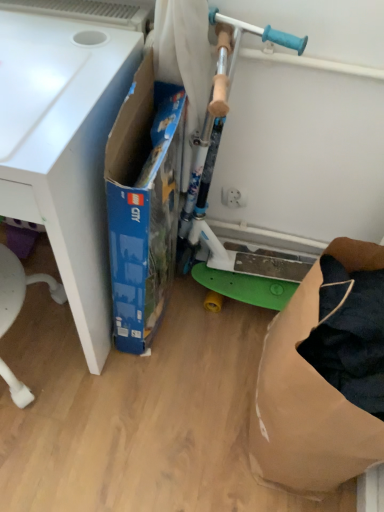
Question: From the image's perspective, relative to brown paper bag at lower right, is blue cardboard box at center above or below?

Choices:
 (A) below
 (B) above

Answer: (B)

Question: Does point (147, 76) appear closer or farther from the camera than point (312, 286)?

Choices:
 (A) closer
 (B) farther

Answer: (B)

Question: Estimate the real-world distances between objects in this image. Which object is farther from the brown paper bag at lower right?

Choices:
 (A) white matte desk at left
 (B) green plastic scooter at center
 (C) blue cardboard box at center

Answer: (A)

Question: Based on their relative distances, which object is nearer to the blue cardboard box at center?

Choices:
 (A) green plastic scooter at center
 (B) white matte desk at left
 (C) brown paper bag at lower right

Answer: (B)